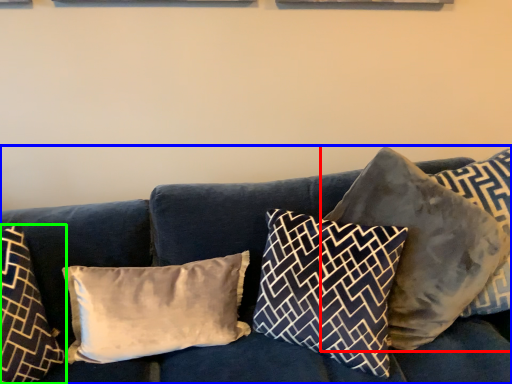
Question: Based on their relative distances, which object is nearer to pillow (highlighted by a red box)? Choose from studio couch (highlighted by a blue box) and pillow (highlighted by a green box).

Choices:
 (A) studio couch
 (B) pillow

Answer: (A)